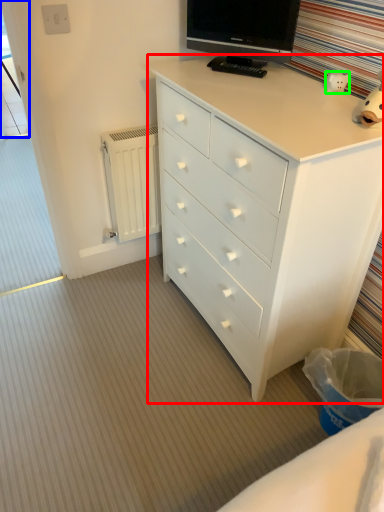
Question: Considering the real-world distances, which object is farthest from chest of drawers (highlighted by a red box)? screen door (highlighted by a blue box) or toy (highlighted by a green box)?

Choices:
 (A) screen door
 (B) toy

Answer: (A)